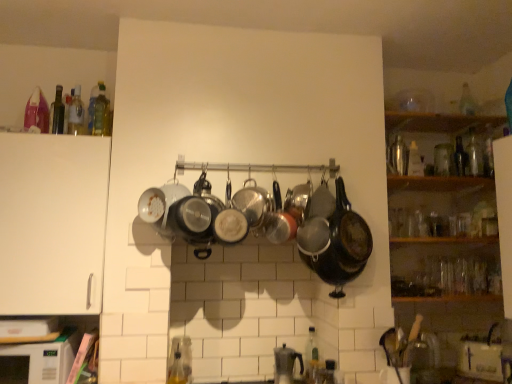
Question: Considering the positions of translucent glass bottle at upper left, the fifth bottle when ordered from front to back, and translucent glass bottle at upper left, the 6th bottle positioned from the back, in the image, is translucent glass bottle at upper left, the fifth bottle when ordered from front to back, bigger or smaller than translucent glass bottle at upper left, the 6th bottle positioned from the back,?

Choices:
 (A) small
 (B) big

Answer: (B)

Question: Considering the positions of translucent glass bottle at upper left, the 3th bottle when ordered from left to right, and translucent glass bottle at upper left, the eighth bottle from the right, in the image, is translucent glass bottle at upper left, the 3th bottle when ordered from left to right, wider or thinner than translucent glass bottle at upper left, the eighth bottle from the right,?

Choices:
 (A) thin
 (B) wide

Answer: (B)

Question: Which is farther from the translucent glass bottle at lower center, arranged as the 5th bottle when viewed from the left?

Choices:
 (A) translucent glass bottle at upper left, the 4th bottle when ordered from front to back
 (B) white matte cabinet at left
 (C) transparent plastic bottle at center, the 6th bottle from the left
 (D) transparent glass bottle at upper right, acting as the 9th bottle starting from the front
 (E) satin silver coffee maker at lower center

Answer: (D)

Question: Which object is positioned farthest from the translucent glass bottle at lower center, which ranks as the fifth bottle in right-to-left order?

Choices:
 (A) transparent glass bottle at upper right, which appears as the 8th bottle when viewed from the left
 (B) shiny black wok at center
 (C) white matte microwave at lower left
 (D) green glass bottle at upper left, the ninth bottle in the right-to-left sequence
 (E) white matte cabinet at left

Answer: (A)